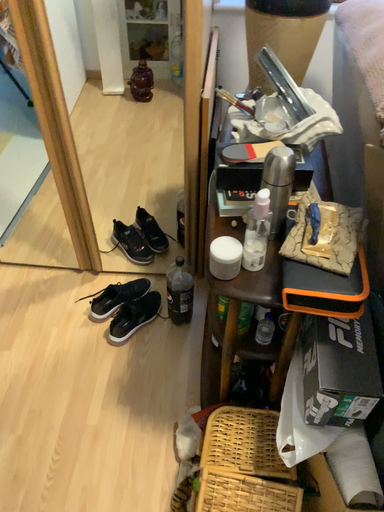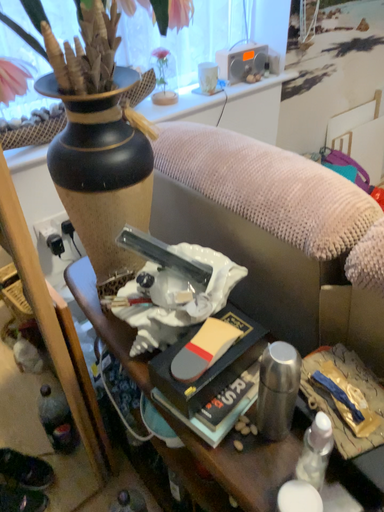
Question: How did the camera likely rotate when shooting the video?

Choices:
 (A) rotated downward
 (B) rotated upward

Answer: (B)